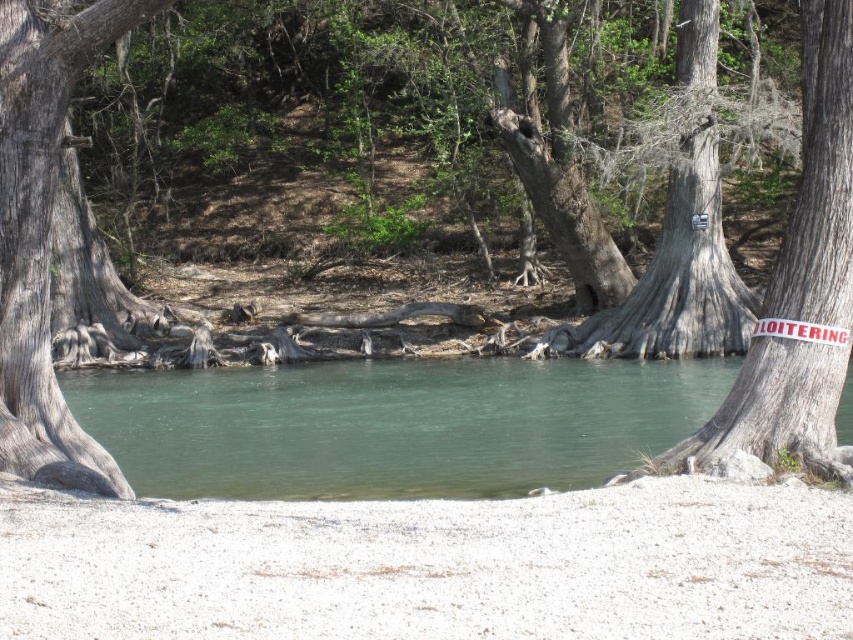
You are standing on the sandy shoreline and want to cross to the other side of the gray rough bark tree trunk at left. Which direction should you walk to avoid stepping into the clear water at center?

You should walk to the left side of the gray rough bark tree trunk at left to avoid stepping into the clear water at center, since the clear water at center is positioned on the right side of the gray rough bark tree trunk at left.

From the picture: You are standing on the sandy shoreline and want to determine which tree trunk is taller between the gray rough tree trunk at center right and the gray rough bark tree trunk at left. Based on the scene, which one is taller?

The gray rough bark tree trunk at left is taller than the gray rough tree trunk at center right, as stated in the description.

Consider the image. You are planning to tie a rope between the gray rough tree trunk at center right and the gray rough bark tree trunk at left for a small boat dock. Which tree trunk can support the rope better based on their sizes?

The gray rough tree trunk at center right has a larger width than the gray rough bark tree trunk at left, so it can support the rope better due to its greater size and strength.